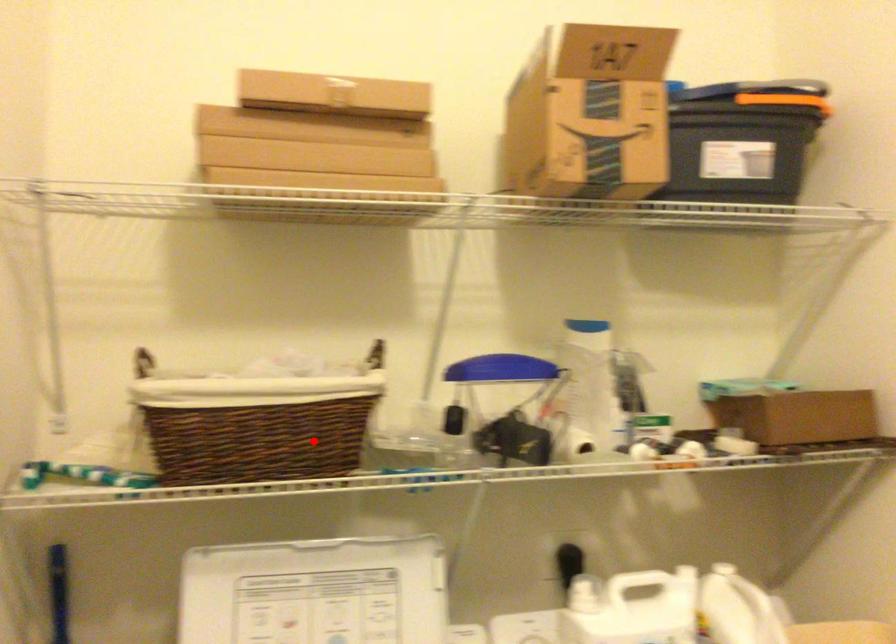
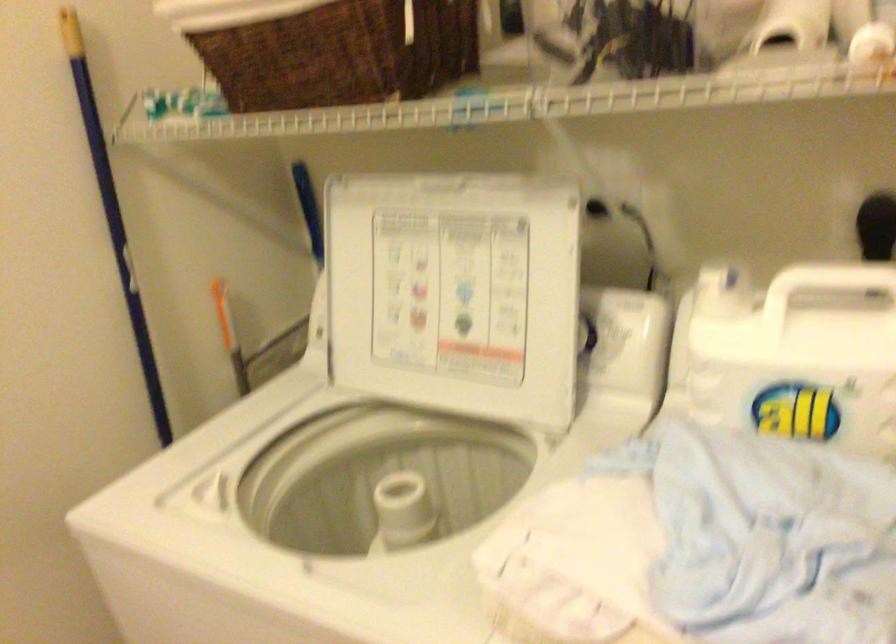
Question: I am providing you with two images of the same scene from different viewpoints. A red point is shown in image1. For the corresponding object point in image2, is it positioned nearer or farther from the camera?

Choices:
 (A) Nearer
 (B) Farther

Answer: (A)